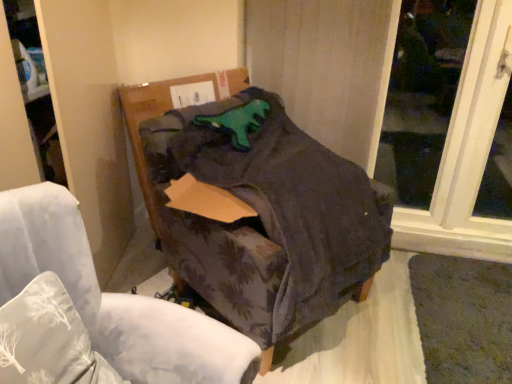
Question: Should I look upward or downward to see transparent glass window at upper right?

Choices:
 (A) up
 (B) down

Answer: (A)

Question: Is dark fabric chair at center at the left side of white fabric pillow at lower left?

Choices:
 (A) yes
 (B) no

Answer: (B)

Question: Is dark fabric chair at center positioned beyond the bounds of white fabric pillow at lower left?

Choices:
 (A) no
 (B) yes

Answer: (B)

Question: Is dark fabric chair at center not close to white fabric pillow at lower left?

Choices:
 (A) no
 (B) yes

Answer: (A)

Question: Is dark fabric chair at center next to white fabric pillow at lower left?

Choices:
 (A) yes
 (B) no

Answer: (B)

Question: Considering the relative sizes of dark fabric chair at center and white fabric pillow at lower left in the image provided, is dark fabric chair at center taller than white fabric pillow at lower left?

Choices:
 (A) yes
 (B) no

Answer: (A)

Question: From the image's perspective, would you say dark fabric chair at center is positioned over white fabric pillow at lower left?

Choices:
 (A) yes
 (B) no

Answer: (A)

Question: Is dark fabric chair at center shorter than purple floral fabric chair at center?

Choices:
 (A) yes
 (B) no

Answer: (B)

Question: From the image's perspective, does dark fabric chair at center appear lower than purple floral fabric chair at center?

Choices:
 (A) no
 (B) yes

Answer: (A)

Question: Can you confirm if dark fabric chair at center is positioned to the right of purple floral fabric chair at center?

Choices:
 (A) yes
 (B) no

Answer: (A)

Question: Considering the relative sizes of dark fabric chair at center and purple floral fabric chair at center in the image provided, is dark fabric chair at center taller than purple floral fabric chair at center?

Choices:
 (A) no
 (B) yes

Answer: (B)

Question: Is purple floral fabric chair at center a part of dark fabric chair at center?

Choices:
 (A) yes
 (B) no

Answer: (B)

Question: From a real-world perspective, is dark fabric chair at center positioned over purple floral fabric chair at center based on gravity?

Choices:
 (A) yes
 (B) no

Answer: (B)

Question: Is white fabric pillow at lower left shorter than cardboard box at center?

Choices:
 (A) no
 (B) yes

Answer: (B)